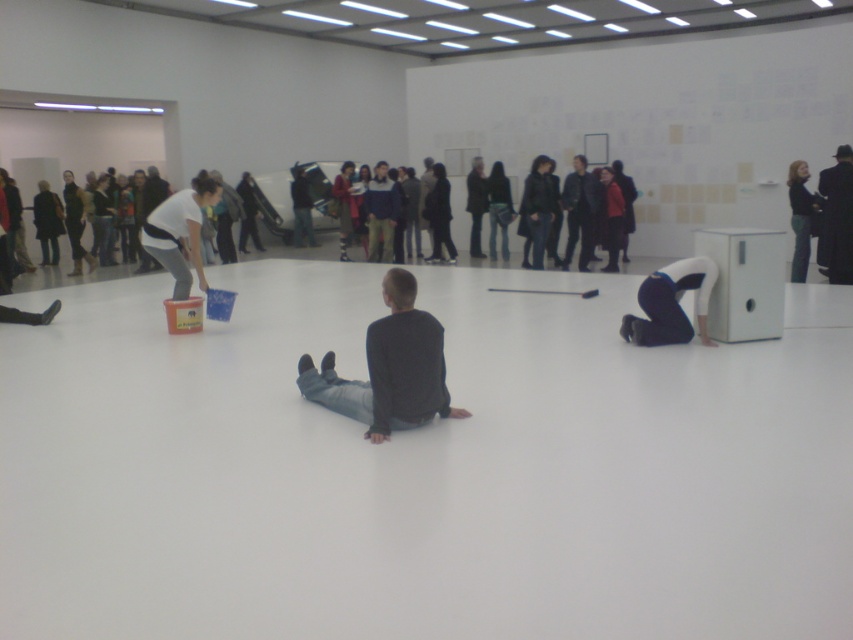
Question: Which point appears farthest from the camera in this image?

Choices:
 (A) (808, 236)
 (B) (199, 218)
 (C) (384, 323)

Answer: (A)

Question: Among these points, which one is nearest to the camera?

Choices:
 (A) (799, 193)
 (B) (216, 189)
 (C) (666, 332)

Answer: (C)

Question: Is black leather hat at upper right bigger than black leather jacket at upper right?

Choices:
 (A) yes
 (B) no

Answer: (A)

Question: Which point is closer to the camera taking this photo?

Choices:
 (A) (355, 396)
 (B) (170, 198)

Answer: (A)

Question: In this image, where is black matte shirt at center located relative to black leather jacket at upper right?

Choices:
 (A) left
 (B) right

Answer: (A)

Question: Can you confirm if black matte shirt at center is bigger than matte white shirt at left?

Choices:
 (A) no
 (B) yes

Answer: (A)